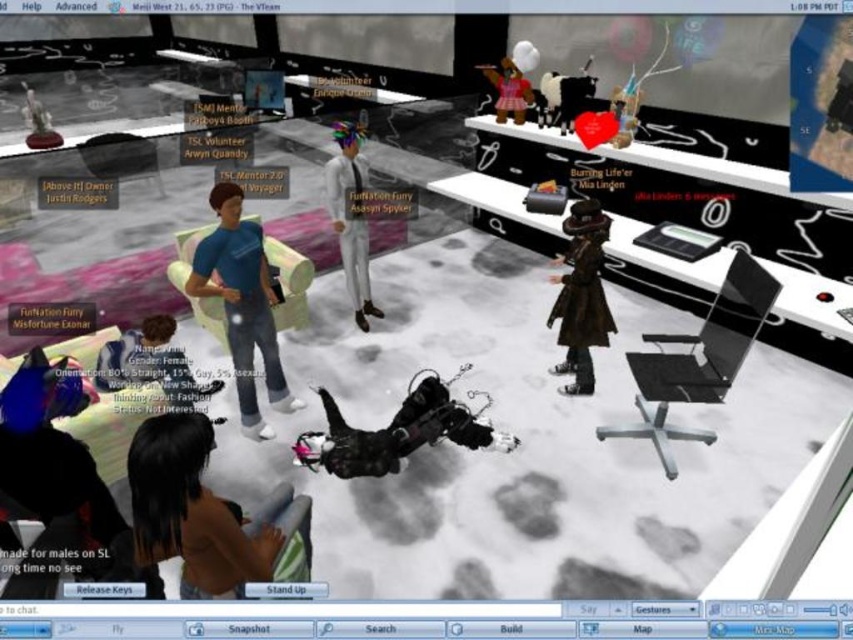
Is blue jeans at center thinner than glossy black computer screen at right?

No.

Does blue jeans at center come behind glossy black computer screen at right?

Yes, blue jeans at center is behind glossy black computer screen at right.

Is point (242, 316) positioned in front of point (703, 323)?

Yes, it is.

Locate an element on the screen. Image resolution: width=853 pixels, height=640 pixels. blue jeans at center is located at coordinates (242, 304).

Does glossy black computer screen at right have a larger size compared to white matte/soft fur at center?

Incorrect, glossy black computer screen at right is not larger than white matte/soft fur at center.

Does point (749, 308) come closer to viewer compared to point (335, 209)?

Yes, it is.

Identify the location of glossy black computer screen at right. (735, 317).

From the picture: Who is shorter, shiny blue hair at lower left or pink satin dress at upper center?

Standing shorter between the two is pink satin dress at upper center.

Is shiny blue hair at lower left closer to camera compared to pink satin dress at upper center?

Yes.

Who is more forward, (x=120, y=572) or (x=502, y=122)?

Point (x=120, y=572) is more forward.

Where is `shiny blue hair at lower left`? The image size is (853, 640). shiny blue hair at lower left is located at coordinates (57, 474).